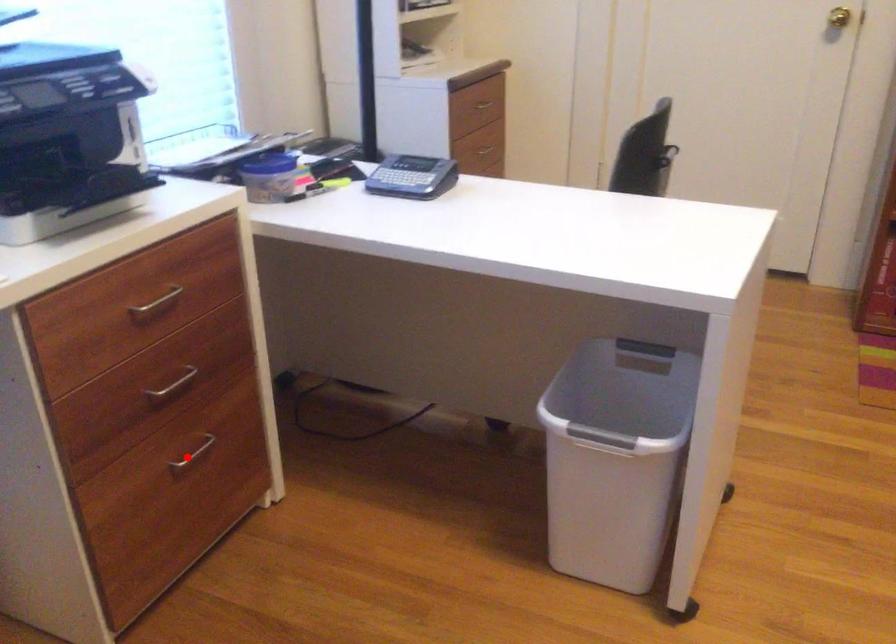
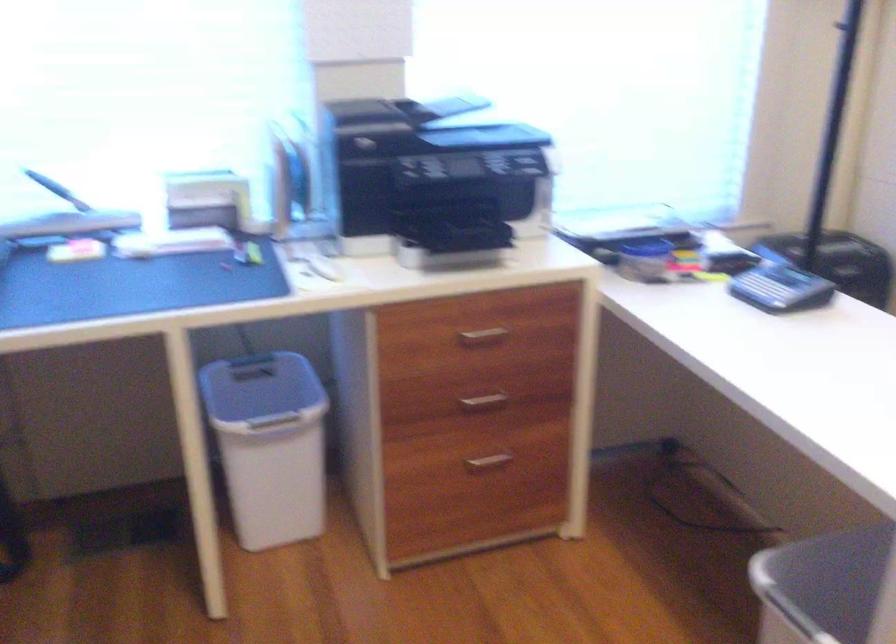
Where in the second image is the point corresponding to the highlighted location from the first image?

(487, 462)